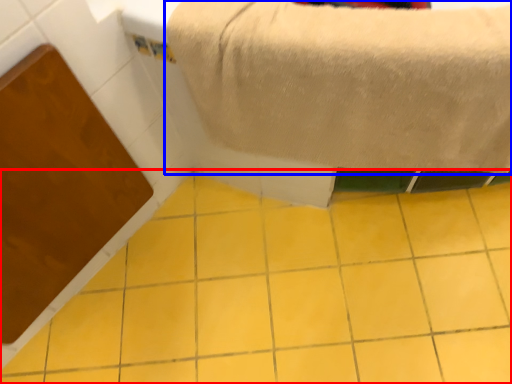
Question: Among these objects, which one is nearest to the camera, ceramic tile (highlighted by a red box) or towel (highlighted by a blue box)?

Choices:
 (A) ceramic tile
 (B) towel

Answer: (B)